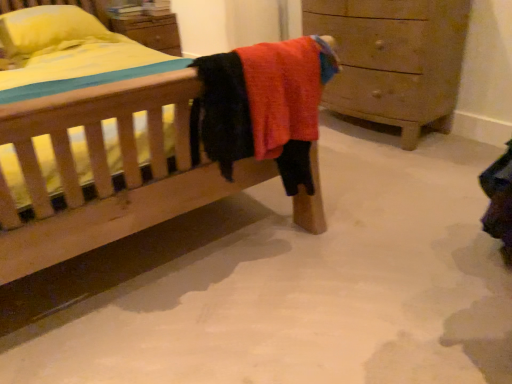
Question: From the image's perspective, is wooden chest of drawers at right located above or below yellow fabric pillow at upper left?

Choices:
 (A) below
 (B) above

Answer: (A)

Question: In the image, is wooden chest of drawers at right on the left side or the right side of yellow fabric pillow at upper left?

Choices:
 (A) right
 (B) left

Answer: (A)

Question: In terms of width, does wooden chest of drawers at right look wider or thinner when compared to yellow fabric pillow at upper left?

Choices:
 (A) thin
 (B) wide

Answer: (A)

Question: Is yellow fabric pillow at upper left wider or thinner than wooden chest of drawers at right?

Choices:
 (A) wide
 (B) thin

Answer: (A)

Question: Is point (15, 23) positioned closer to the camera than point (386, 104)?

Choices:
 (A) closer
 (B) farther

Answer: (B)

Question: Considering the positions of yellow fabric pillow at upper left and wooden chest of drawers at right in the image, is yellow fabric pillow at upper left bigger or smaller than wooden chest of drawers at right?

Choices:
 (A) small
 (B) big

Answer: (A)

Question: Based on their positions, is yellow fabric pillow at upper left located to the left or right of wooden chest of drawers at right?

Choices:
 (A) left
 (B) right

Answer: (A)